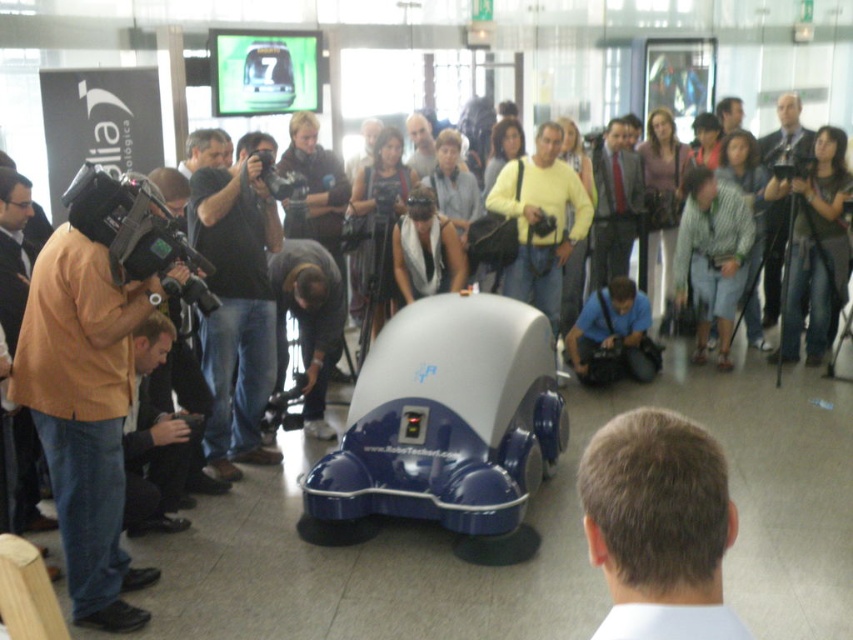
You are an event organizer at the RoboTech exhibition. You need to place a new promotional banner that is 2 meters wide between the dark gray fabric at center and the green glossy car at center. Based on their sizes, will the banner fit between them?

The dark gray fabric at center is larger than the green glossy car at center. Since the banner is 2 meters wide, it can fit between them as there is sufficient space due to the larger size of the dark gray fabric at center.